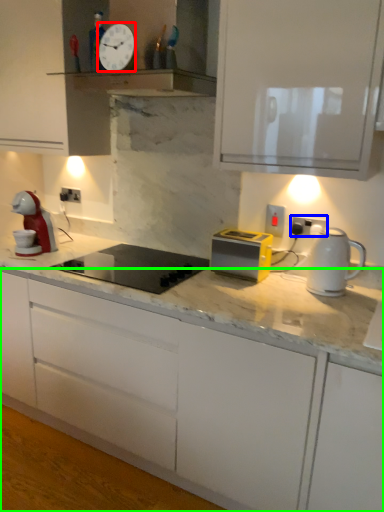
Question: Considering the real-world distances, which object is closest to clock (highlighted by a red box)? electric outlet (highlighted by a blue box) or cabinetry (highlighted by a green box).

Choices:
 (A) electric outlet
 (B) cabinetry

Answer: (A)